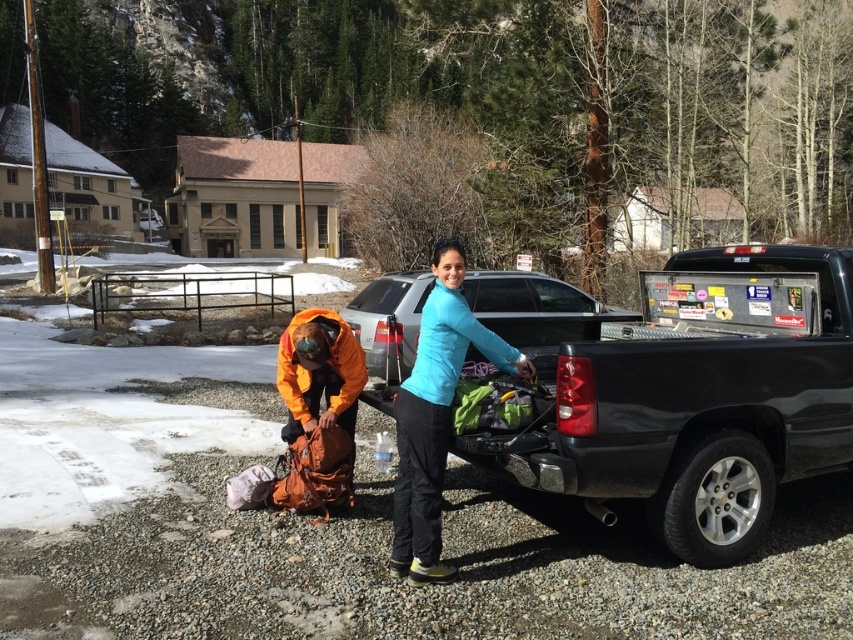
Between point (749, 401) and point (424, 330), which one is positioned in front?

Point (424, 330) is in front.

Can you confirm if matte black truck bed at center is bigger than blue matte jacket at center?

Correct, matte black truck bed at center is larger in size than blue matte jacket at center.

What do you see at coordinates (694, 396) in the screenshot? This screenshot has width=853, height=640. I see `matte black truck bed at center` at bounding box center [694, 396].

The width and height of the screenshot is (853, 640). I want to click on matte black truck bed at center, so click(x=694, y=396).